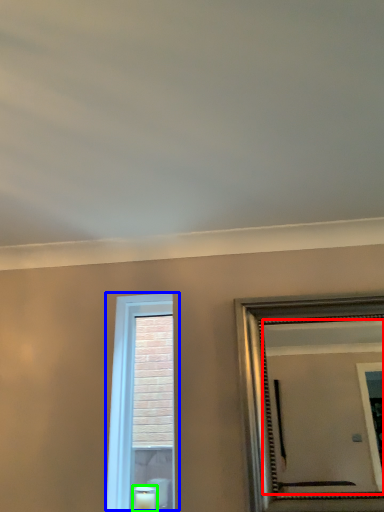
Question: Which object is positioned closest to mirror (highlighted by a red box)? Select from window (highlighted by a blue box) and candle (highlighted by a green box).

Choices:
 (A) window
 (B) candle

Answer: (A)